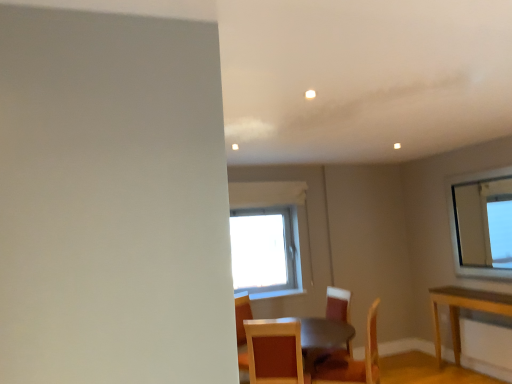
Question: Is wooden chair at center, which appears as the 3th chair when viewed from the front, looking in the opposite direction of wooden chair at center, marked as the 2th chair in a front-to-back arrangement?

Choices:
 (A) no
 (B) yes

Answer: (A)

Question: Does wooden chair at center, which appears as the 3th chair when viewed from the front, come in front of wooden chair at center, marked as the 2th chair in a front-to-back arrangement?

Choices:
 (A) no
 (B) yes

Answer: (A)

Question: Is wooden chair at center, which appears as the 3th chair when viewed from the front, wider than wooden chair at center, marked as the 2th chair in a front-to-back arrangement?

Choices:
 (A) yes
 (B) no

Answer: (B)

Question: Would you say wooden chair at center, which appears as the 3th chair when viewed from the front, is outside wooden chair at center, marked as the 2th chair in a front-to-back arrangement?

Choices:
 (A) no
 (B) yes

Answer: (B)

Question: Is the position of wooden chair at center, positioned as the 1th chair in back-to-front order, more distant than that of wooden chair at center, marked as the 2th chair in a front-to-back arrangement?

Choices:
 (A) yes
 (B) no

Answer: (A)

Question: Is point (328, 352) closer or farther from the camera than point (375, 312)?

Choices:
 (A) closer
 (B) farther

Answer: (B)

Question: Looking at the image, does wooden chair at center, which appears as the 3th chair when viewed from the front, seem bigger or smaller compared to wooden chair at center, which is counted as the 2th chair, starting from the back?

Choices:
 (A) big
 (B) small

Answer: (A)

Question: From their relative heights in the image, would you say wooden chair at center, which appears as the 3th chair when viewed from the front, is taller or shorter than wooden chair at center, which is counted as the 2th chair, starting from the back?

Choices:
 (A) tall
 (B) short

Answer: (A)

Question: From the image's perspective, is wooden chair at center, positioned as the 1th chair in back-to-front order, above or below wooden chair at center, marked as the 2th chair in a front-to-back arrangement?

Choices:
 (A) above
 (B) below

Answer: (B)

Question: From a real-world perspective, is wooden chair at center, marked as the 2th chair in a front-to-back arrangement, physically located above or below wooden textured chair at lower center, arranged as the third chair when viewed from the back?

Choices:
 (A) below
 (B) above

Answer: (A)

Question: Is wooden chair at center, marked as the 2th chair in a front-to-back arrangement, bigger or smaller than wooden textured chair at lower center, which is counted as the first chair, starting from the front?

Choices:
 (A) small
 (B) big

Answer: (B)

Question: Considering the positions of wooden chair at center, marked as the 2th chair in a front-to-back arrangement, and wooden textured chair at lower center, arranged as the third chair when viewed from the back, in the image, is wooden chair at center, marked as the 2th chair in a front-to-back arrangement, wider or thinner than wooden textured chair at lower center, arranged as the third chair when viewed from the back,?

Choices:
 (A) thin
 (B) wide

Answer: (A)

Question: Is wooden chair at center, which is counted as the 2th chair, starting from the back, taller or shorter than wooden textured chair at lower center, arranged as the third chair when viewed from the back?

Choices:
 (A) tall
 (B) short

Answer: (A)

Question: From the image's perspective, is wooden chair at center, which appears as the 3th chair when viewed from the front, positioned above or below wooden textured chair at lower center, which is counted as the first chair, starting from the front?

Choices:
 (A) below
 (B) above

Answer: (A)

Question: Would you say wooden chair at center, which appears as the 3th chair when viewed from the front, is to the left or to the right of wooden textured chair at lower center, arranged as the third chair when viewed from the back, in the picture?

Choices:
 (A) right
 (B) left

Answer: (A)